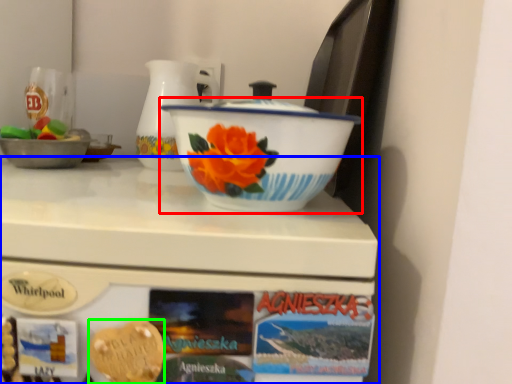
Question: Based on their relative distances, which object is farther from basin (highlighted by a red box)? Choose from table (highlighted by a blue box) and food (highlighted by a green box).

Choices:
 (A) table
 (B) food

Answer: (B)